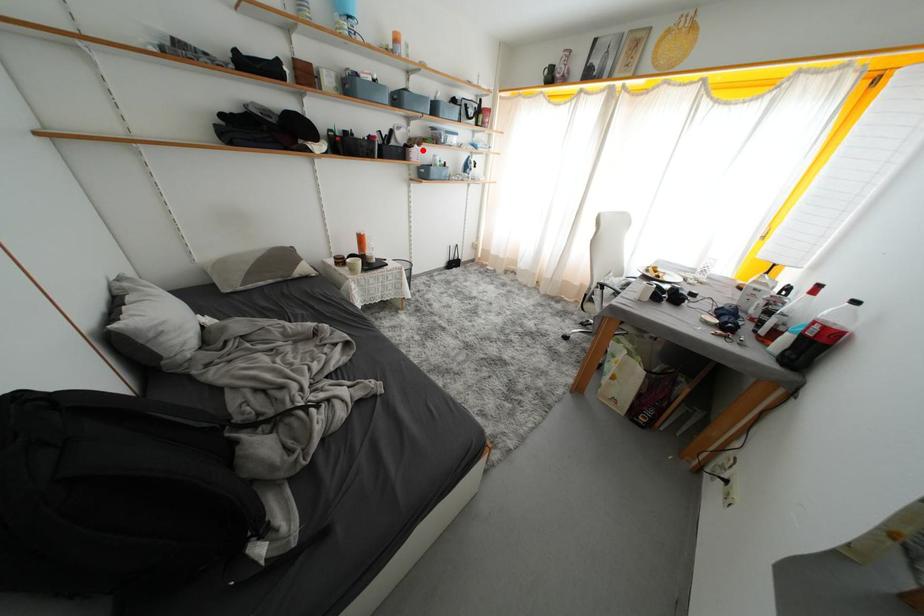
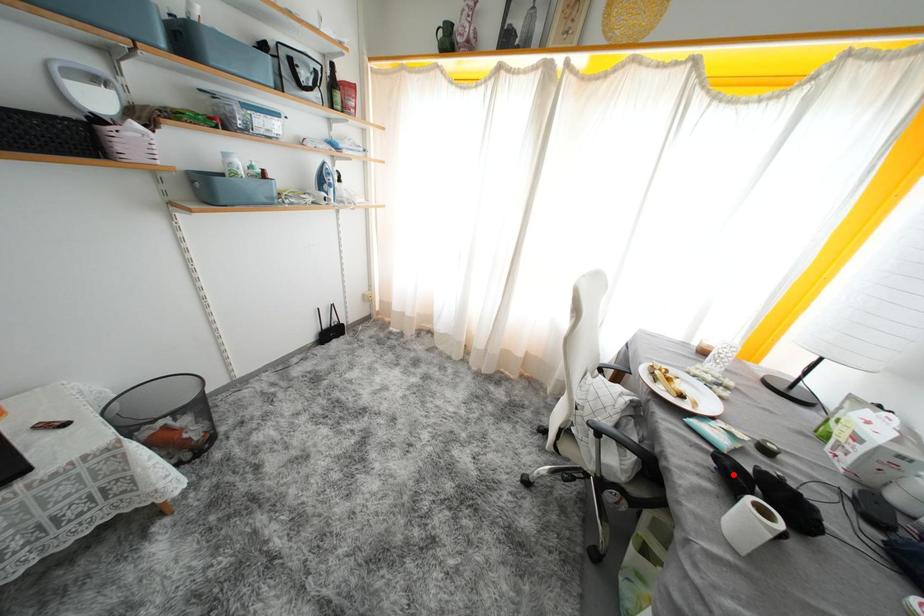
I am providing you with two images of the same scene from different viewpoints. A red point is marked on the first image and another point is marked on the second image. Are the points marked in image1 and image2 representing the same 3D position?

No